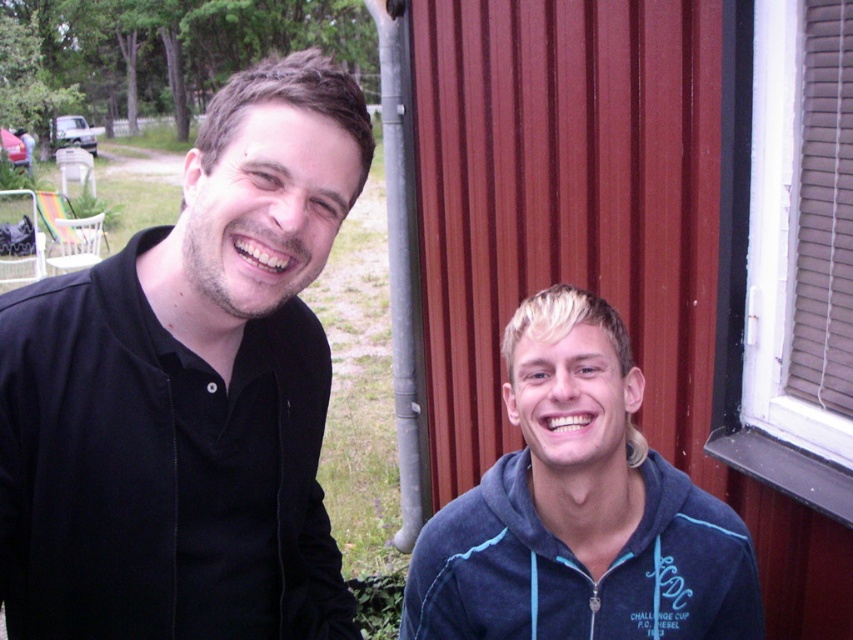
Question: Can you confirm if black matte shirt at left is positioned to the left of blue fleece sweatshirt at lower right?

Choices:
 (A) no
 (B) yes

Answer: (B)

Question: Which point is closer to the camera?

Choices:
 (A) pyautogui.click(x=712, y=536)
 (B) pyautogui.click(x=21, y=384)

Answer: (B)

Question: Among these objects, which one is nearest to the camera?

Choices:
 (A) blue fleece sweatshirt at lower right
 (B) black matte shirt at left

Answer: (B)

Question: Which of the following is the farthest from the observer?

Choices:
 (A) (650, 483)
 (B) (175, 476)

Answer: (A)

Question: Does black matte shirt at left appear under blue fleece sweatshirt at lower right?

Choices:
 (A) yes
 (B) no

Answer: (B)

Question: Can you confirm if black matte shirt at left is bigger than blue fleece sweatshirt at lower right?

Choices:
 (A) no
 (B) yes

Answer: (B)